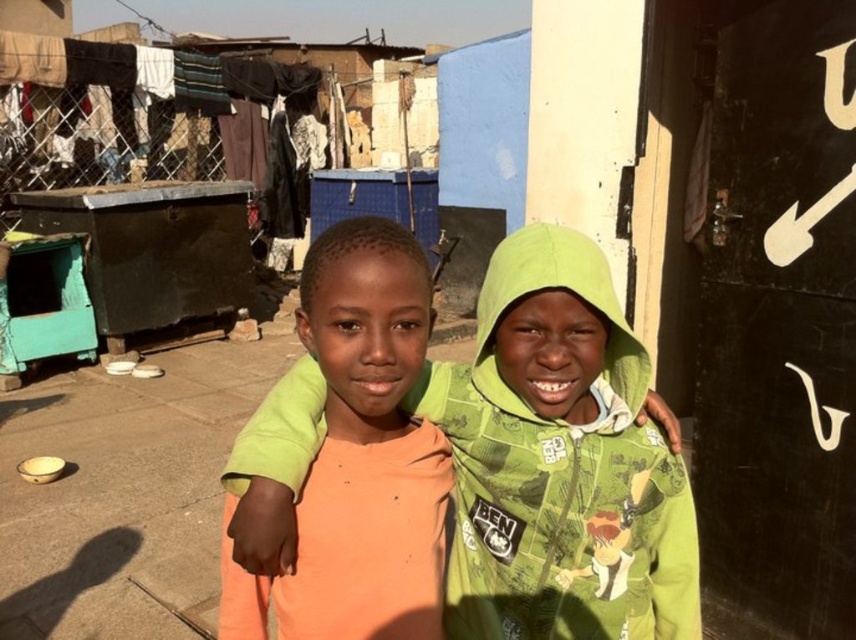
You are a tailor who needs to determine which clothing item requires more fabric for alterations. Based on the scene, which clothing item between the green cotton hoodie at center and the orange cotton shirt at center would need more fabric?

The green cotton hoodie at center has a larger size compared to orange cotton shirt at center, so it would require more fabric for alterations.

You are a photographer trying to capture a photo of the two children in the scene. You want to ensure that the orange cotton shirt at center and the green cotton hoodie at center are both clearly visible in the frame. Based on their positions, which child should be positioned to the left in the photo?

The orange cotton shirt at center should be positioned to the left in the photo because the green cotton hoodie at center is to the right of it.

You are a tailor who needs to compare the sizes of the two garments. Given that the green cotton hoodie at center and the orange cotton shirt at center are both in front of you, which one has a greater width?

The green cotton hoodie at center has a greater width than the orange cotton shirt at center.